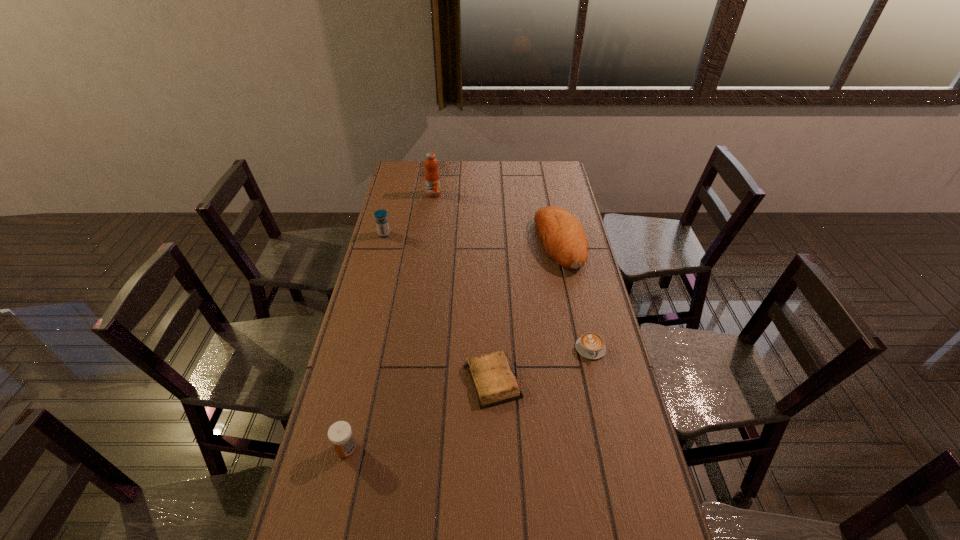
Locate an element on the screen. The width and height of the screenshot is (960, 540). vacant space at the far right corner of the desktop is located at coordinates coord(546,161).

This screenshot has height=540, width=960. I want to click on free space between the farther medicine and the cappuccino, so click(488, 292).

In order to click on vacant point located between the tallest object and the bread in this screenshot , I will do `click(497, 219)`.

Find the location of `vacant space that's between the cappuccino and the farther medicine`. vacant space that's between the cappuccino and the farther medicine is located at coordinates (x=488, y=292).

Image resolution: width=960 pixels, height=540 pixels. In order to click on free point between the diary and the bread in this screenshot , I will do `click(526, 312)`.

Identify the location of free space between the third object from right to left and the cappuccino. (541, 364).

Identify the location of vacant point located between the farther medicine and the fourth tallest object. (366, 342).

Locate an element on the screen. The width and height of the screenshot is (960, 540). vacant region between the nearest object and the farthest object is located at coordinates (390, 321).

Image resolution: width=960 pixels, height=540 pixels. Find the location of `empty location between the shorter medicine and the bread`. empty location between the shorter medicine and the bread is located at coordinates (453, 346).

In order to click on free space that is in between the cappuccino and the bread in this screenshot , I will do `click(575, 296)`.